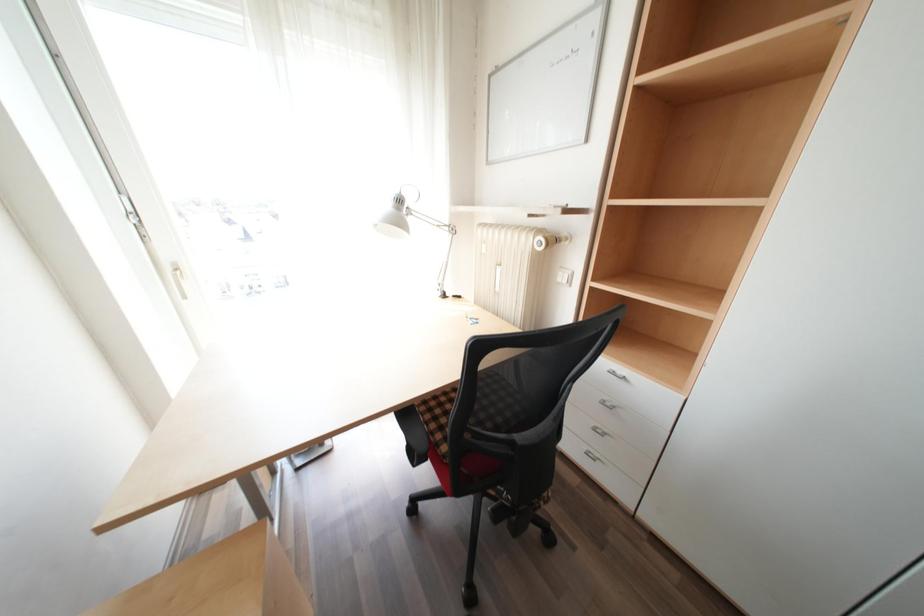
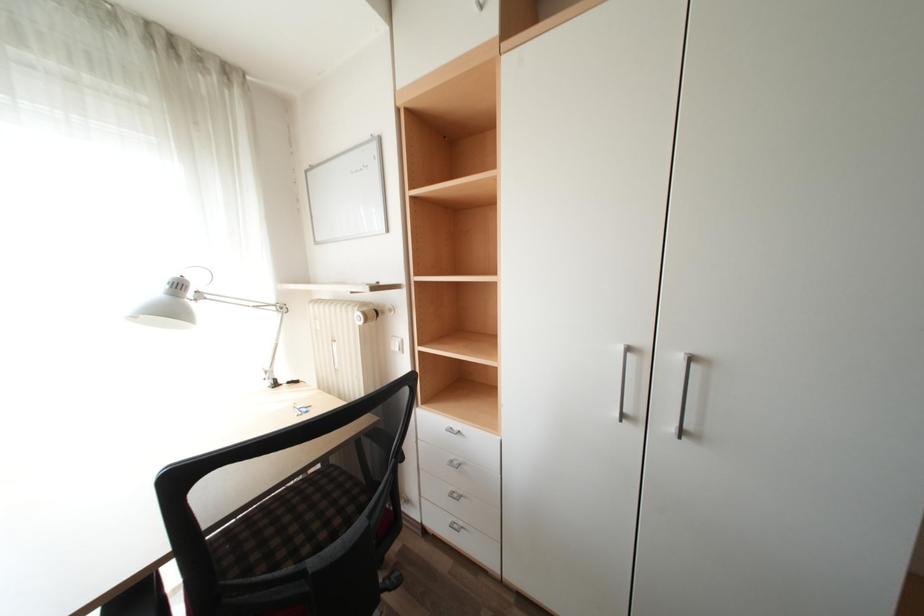
Question: Based on the continuous images, in which direction is the camera rotating? Reply with the corresponding letter.

Choices:
 (A) Left
 (B) Right
 (C) Up
 (D) Down

Answer: (B)